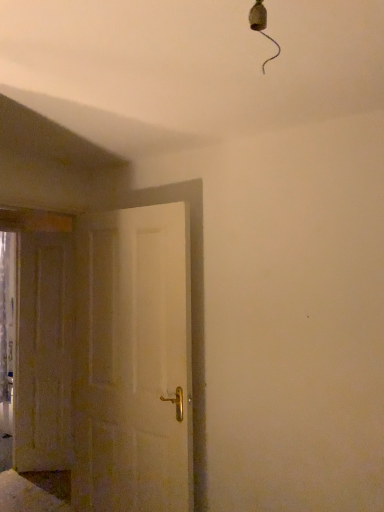
Question: From a real-world perspective, is wooden door at left, which appears as the first door when viewed from the back, positioned under white matte door at center, acting as the 1th door starting from the right, based on gravity?

Choices:
 (A) no
 (B) yes

Answer: (B)

Question: Is wooden door at left, which appears as the first door when viewed from the back, outside of white matte door at center, acting as the 1th door starting from the right?

Choices:
 (A) yes
 (B) no

Answer: (A)

Question: Does wooden door at left, the second door when ordered from right to left, come in front of white matte door at center, the second door viewed from the back?

Choices:
 (A) yes
 (B) no

Answer: (B)

Question: Does wooden door at left, which appears as the first door when viewed from the back, have a greater width compared to white matte door at center, the second door viewed from the back?

Choices:
 (A) yes
 (B) no

Answer: (B)

Question: Does wooden door at left, which appears as the 2th door when viewed from the front, have a larger size compared to white matte door at center, the second door viewed from the back?

Choices:
 (A) yes
 (B) no

Answer: (B)

Question: Considering the relative positions of wooden door at left, the first door when ordered from left to right, and white matte door at center, which is the first door in front-to-back order, in the image provided, is wooden door at left, the first door when ordered from left to right, to the right of white matte door at center, which is the first door in front-to-back order, from the viewer's perspective?

Choices:
 (A) yes
 (B) no

Answer: (B)

Question: From a real-world perspective, is white matte door at center, the second door viewed from the back, physically below wooden door at left, the first door when ordered from left to right?

Choices:
 (A) yes
 (B) no

Answer: (B)

Question: Is white matte door at center, which is the first door in front-to-back order, with wooden door at left, which appears as the 2th door when viewed from the front?

Choices:
 (A) no
 (B) yes

Answer: (A)

Question: Is white matte door at center, the second door viewed from the back, thinner than wooden door at left, the second door when ordered from right to left?

Choices:
 (A) no
 (B) yes

Answer: (A)

Question: Does white matte door at center, which is the first door in front-to-back order, have a smaller size compared to wooden door at left, the second door when ordered from right to left?

Choices:
 (A) yes
 (B) no

Answer: (B)

Question: Is white matte door at center, the second door viewed from the back, turned away from wooden door at left, the first door when ordered from left to right?

Choices:
 (A) no
 (B) yes

Answer: (A)

Question: Is white matte door at center, acting as the 1th door starting from the right, far away from wooden door at left, which appears as the first door when viewed from the back?

Choices:
 (A) no
 (B) yes

Answer: (B)

Question: From the image's perspective, is white matte door at center, which is the first door in front-to-back order, located above or below wooden door at left, which appears as the first door when viewed from the back?

Choices:
 (A) above
 (B) below

Answer: (A)